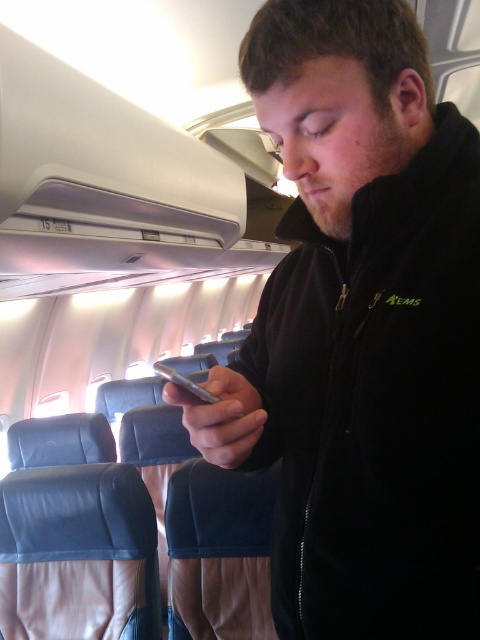
You are a flight attendant checking the dimensions of items passengers are carrying. You notice a passenger has a silver metallic smartphone at center and a green fabric aems at center. According to airline regulations, any item wider than 15 cm is not allowed in the overhead compartment. Can both items be stored in the overhead compartment?

The silver metallic smartphone at center has a larger width than the green fabric aems at center. However, since the exact width of either item isn not provided, it is impossible to determine if they meet the airline regulation of being under 15 cm. Please measure both items to confirm.

Consider the image. You are a flight attendant checking the dimensions of passengers items. The airline requires that all items placed in the overhead compartment must be no wider than 40 cm. You observe the black fleece jacket at center and the silver metallic smartphone at center. Which item is narrower and can fit in the overhead compartment?

The black fleece jacket at center has a lesser width compared to silver metallic smartphone at center, so the black fleece jacket at center is narrower and can fit in the overhead compartment.

You are a flight attendant checking the cabin. You see the black fleece jacket at center and the silver metallic smartphone at center. Which item is closer to you?

The black fleece jacket at center is closer to the viewer than the silver metallic smartphone at center.